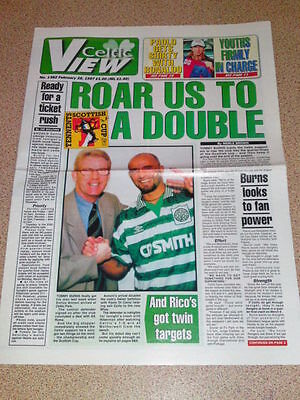
The width and height of the screenshot is (300, 400). Find the location of `fan`. fan is located at coordinates pos(257,203).